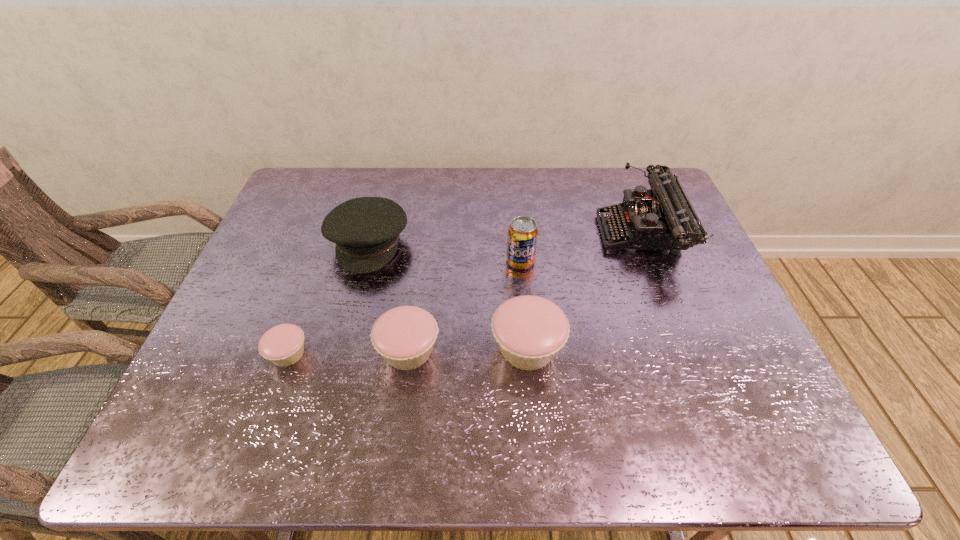
Where is `free space for a new cupcake on the right`? This screenshot has width=960, height=540. free space for a new cupcake on the right is located at coordinates (645, 345).